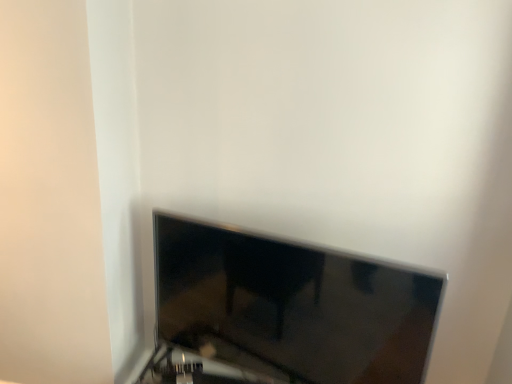
Find the location of `matte black tv at lower right`. matte black tv at lower right is located at coordinates (292, 306).

Describe the element at coordinates (292, 306) in the screenshot. I see `matte black tv at lower right` at that location.

In order to face matte black tv at lower right, should I rotate leftwards or rightwards?

You should rotate right by 2.762 degrees.

What is the approximate width of matte black tv at lower right?

2.86 inches.

This screenshot has width=512, height=384. Identify the location of matte black tv at lower right. (292, 306).